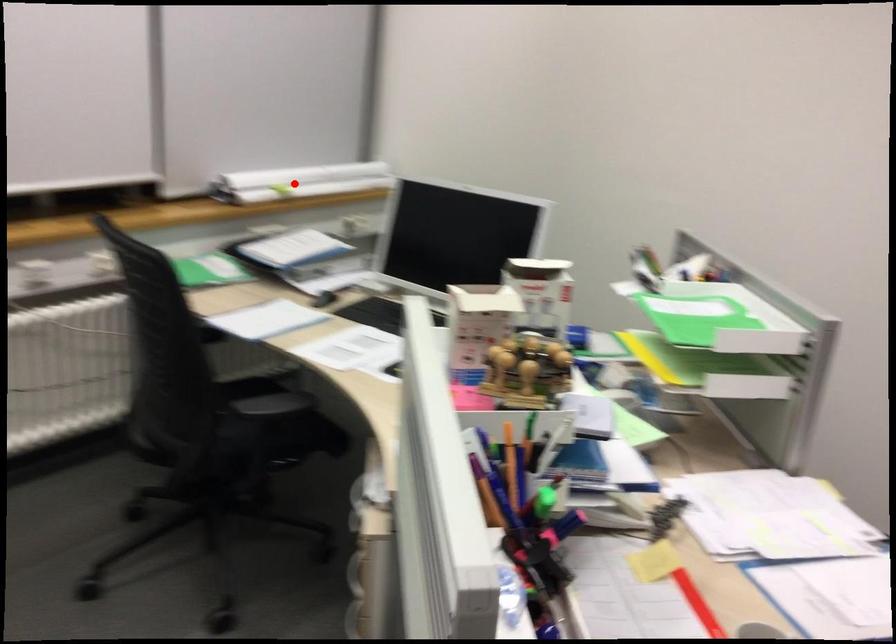
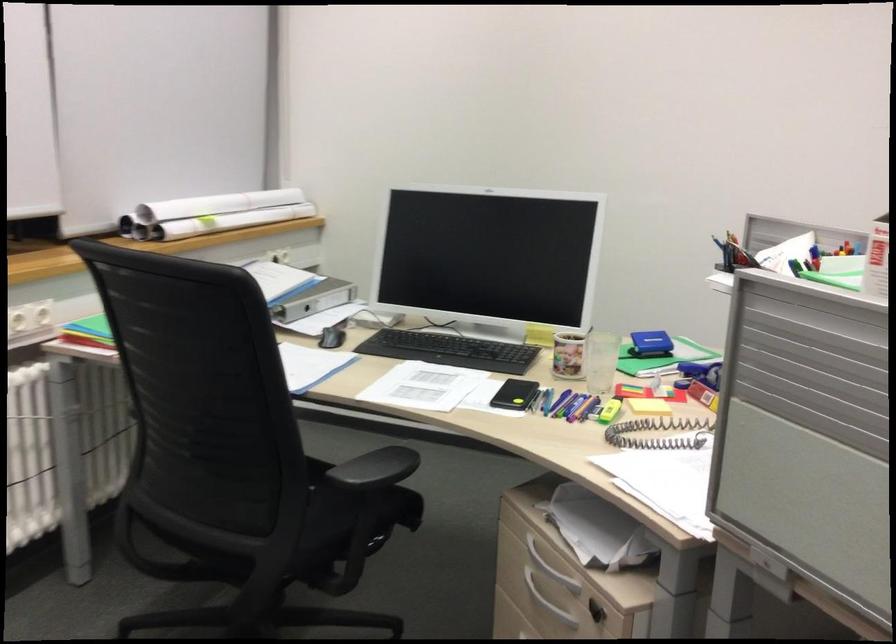
The point at the highlighted location is marked in the first image. Where is the corresponding point in the second image?

(212, 214)